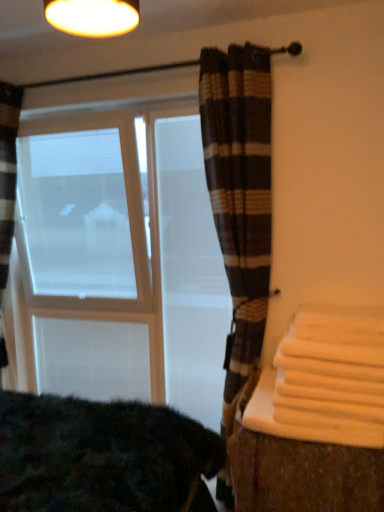
Identify the location of empty space that is ontop of white frosted glass bay window at left (from a real-world perspective). pos(111,99).